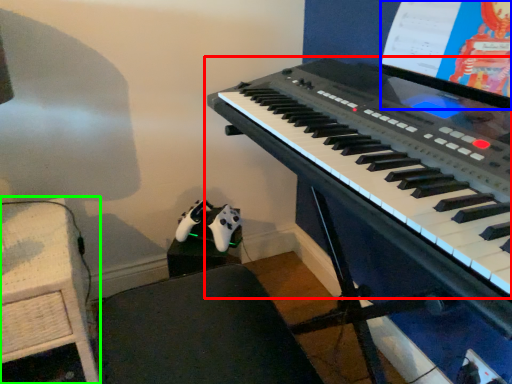
Question: Which object is positioned closest to musical keyboard (highlighted by a red box)? Select from computer screen (highlighted by a blue box) and table (highlighted by a green box).

Choices:
 (A) computer screen
 (B) table

Answer: (A)